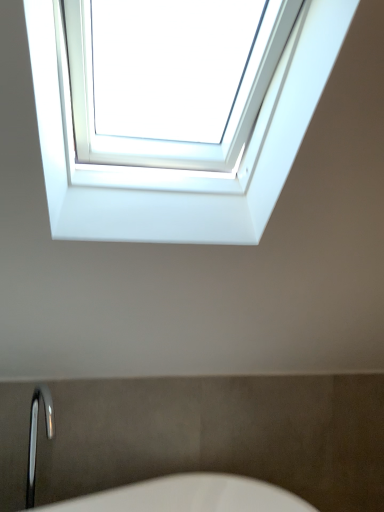
At what (x,y) coordinates should I click in order to perform the action: click on polished chrome faucet at lower left. Please return your answer as a coordinate pair (x, y). This screenshot has height=512, width=384. Looking at the image, I should click on (36, 436).

The width and height of the screenshot is (384, 512). What do you see at coordinates (36, 436) in the screenshot? I see `polished chrome faucet at lower left` at bounding box center [36, 436].

Looking at this image, what is the approximate height of polished chrome faucet at lower left?

It is 19.41 inches.

This screenshot has height=512, width=384. Find the location of `white plastic window at upper center`. white plastic window at upper center is located at coordinates (176, 173).

Describe the element at coordinates (176, 173) in the screenshot. I see `white plastic window at upper center` at that location.

Measure the distance between white plastic window at upper center and camera.

white plastic window at upper center is 27.78 inches away from camera.

Locate an element on the screen. polished chrome faucet at lower left is located at coordinates (36, 436).

Considering the positions of objects polished chrome faucet at lower left and white plastic window at upper center in the image provided, who is more to the left, polished chrome faucet at lower left or white plastic window at upper center?

Positioned to the left is polished chrome faucet at lower left.

Is polished chrome faucet at lower left further to camera compared to white plastic window at upper center?

Yes.

Which is behind, point (48, 439) or point (328, 19)?

The point (48, 439) is behind.

From the image's perspective, is polished chrome faucet at lower left on top of white plastic window at upper center?

Actually, polished chrome faucet at lower left appears below white plastic window at upper center in the image.

From a real-world perspective, is polished chrome faucet at lower left located beneath white plastic window at upper center?

Yes, from a real-world perspective, polished chrome faucet at lower left is beneath white plastic window at upper center.

Can you confirm if polished chrome faucet at lower left is thinner than white plastic window at upper center?

Correct, the width of polished chrome faucet at lower left is less than that of white plastic window at upper center.

From their relative heights in the image, would you say polished chrome faucet at lower left is taller or shorter than white plastic window at upper center?

polished chrome faucet at lower left is shorter than white plastic window at upper center.

Which of these two, polished chrome faucet at lower left or white plastic window at upper center, is smaller?

polished chrome faucet at lower left is smaller.

Which is correct: polished chrome faucet at lower left is inside white plastic window at upper center, or outside of it?

polished chrome faucet at lower left is outside white plastic window at upper center.

Are polished chrome faucet at lower left and white plastic window at upper center far apart?

Indeed, polished chrome faucet at lower left is not near white plastic window at upper center.

Is polished chrome faucet at lower left aimed at white plastic window at upper center?

No, polished chrome faucet at lower left is not facing towards white plastic window at upper center.

What's the angular difference between polished chrome faucet at lower left and white plastic window at upper center's facing directions?

The angle between the facing direction of polished chrome faucet at lower left and the facing direction of white plastic window at upper center is 21.6 degrees.

How far apart are polished chrome faucet at lower left and white plastic window at upper center?

polished chrome faucet at lower left and white plastic window at upper center are 1.13 meters apart from each other.

The width and height of the screenshot is (384, 512). Identify the location of faucet behind the white plastic window at upper center. (36, 436).

Which is more to the left, white plastic window at upper center or polished chrome faucet at lower left?

Positioned to the left is polished chrome faucet at lower left.

Is white plastic window at upper center positioned behind polished chrome faucet at lower left?

No, white plastic window at upper center is in front of polished chrome faucet at lower left.

Which is closer, (35, 41) or (50, 437)?

Point (35, 41).

From the image's perspective, which one is positioned lower, white plastic window at upper center or polished chrome faucet at lower left?

polished chrome faucet at lower left appears lower in the image.

From a real-world perspective, who is located higher, white plastic window at upper center or polished chrome faucet at lower left?

white plastic window at upper center is physically above.

Can you confirm if white plastic window at upper center is wider than polished chrome faucet at lower left?

Yes, white plastic window at upper center is wider than polished chrome faucet at lower left.

Which of these two, white plastic window at upper center or polished chrome faucet at lower left, stands taller?

Result: Standing taller between the two is white plastic window at upper center.

Considering the sizes of objects white plastic window at upper center and polished chrome faucet at lower left in the image provided, who is bigger, white plastic window at upper center or polished chrome faucet at lower left?

white plastic window at upper center.

Can polished chrome faucet at lower left be found inside white plastic window at upper center?

No.

Is white plastic window at upper center next to polished chrome faucet at lower left and touching it?

→ No.

Is white plastic window at upper center looking in the opposite direction of polished chrome faucet at lower left?

No, polished chrome faucet at lower left is not at the back of white plastic window at upper center.

How much distance is there between white plastic window at upper center and polished chrome faucet at lower left?

white plastic window at upper center and polished chrome faucet at lower left are 3.69 feet apart from each other.

The width and height of the screenshot is (384, 512). I want to click on faucet that is behind the white plastic window at upper center, so tap(36, 436).

At what (x,y) coordinates should I click in order to perform the action: click on faucet directly beneath the white plastic window at upper center (from a real-world perspective). Please return your answer as a coordinate pair (x, y). This screenshot has width=384, height=512. Looking at the image, I should click on (36, 436).

Identify the location of faucet lying on the left of white plastic window at upper center. (36, 436).